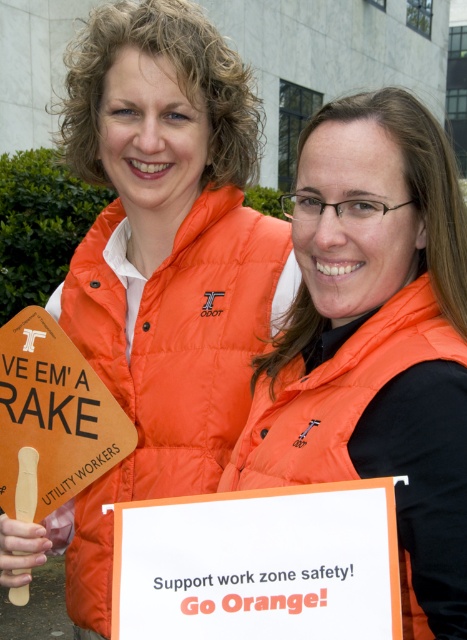
Question: Which of these objects is positioned closest to the orange puffy vest at upper center?

Choices:
 (A) white paper sign at center
 (B) woodensign at left
 (C) orange puffy vest at center

Answer: (B)

Question: Is orange puffy vest at upper center wider than orange puffy vest at center?

Choices:
 (A) no
 (B) yes

Answer: (B)

Question: Among these objects, which one is nearest to the camera?

Choices:
 (A) orange puffy vest at upper center
 (B) woodensign at left
 (C) white paper sign at center
 (D) orange puffy vest at center

Answer: (C)

Question: Which is farther from the orange puffy vest at upper center?

Choices:
 (A) woodensign at left
 (B) white paper sign at center
 (C) orange puffy vest at center

Answer: (B)

Question: Is white paper sign at center above orange puffy vest at center?

Choices:
 (A) no
 (B) yes

Answer: (A)

Question: Can you confirm if orange puffy vest at upper center is wider than orange puffy vest at center?

Choices:
 (A) yes
 (B) no

Answer: (A)